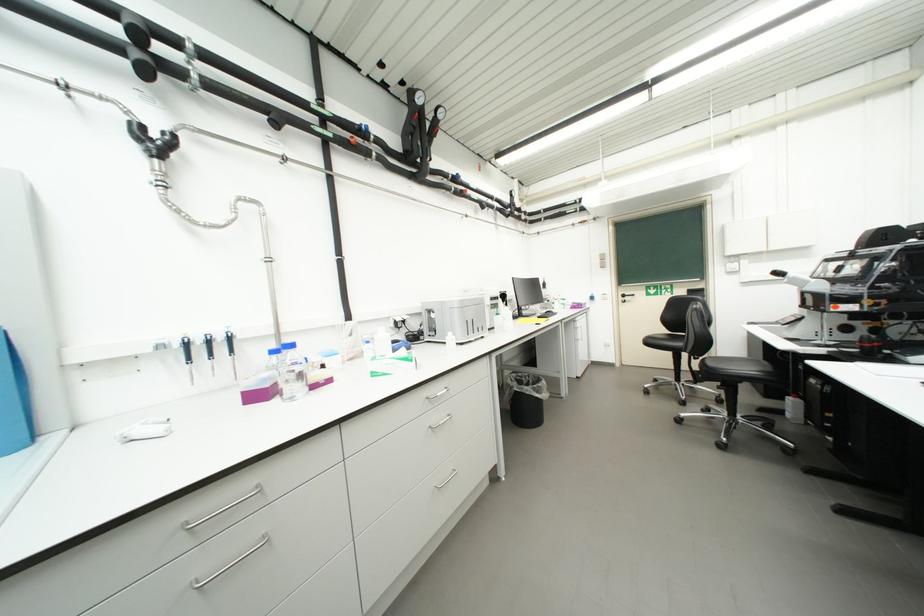
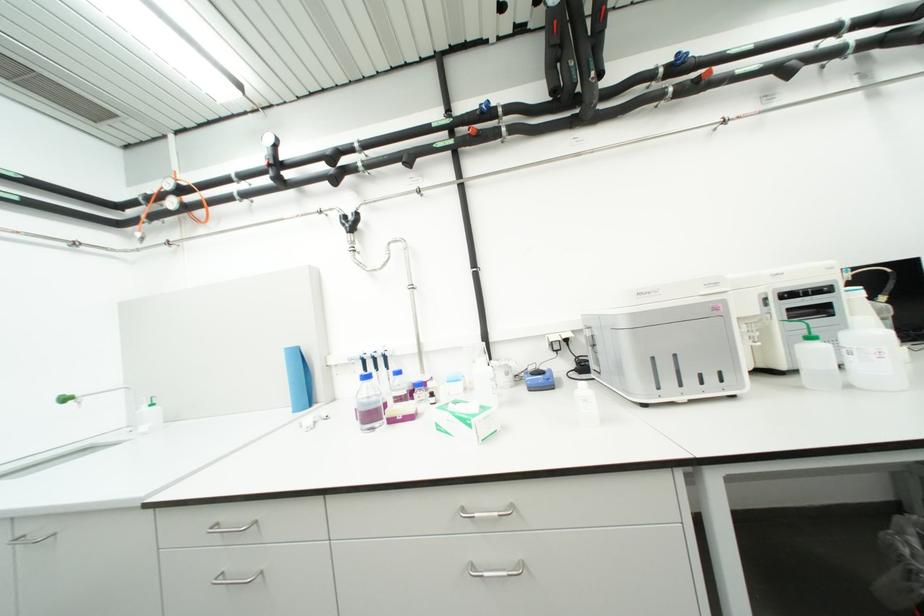
Locate, in the second image, the point that corresponds to [505,315] in the first image.

(819, 339)